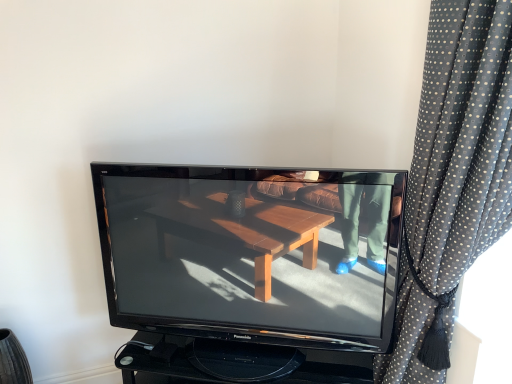
Question: From the image's perspective, is black glossy television at center located above or below black dotted fabric at right?

Choices:
 (A) above
 (B) below

Answer: (B)

Question: Considering the positions of black glossy television at center and black dotted fabric at right in the image, is black glossy television at center wider or thinner than black dotted fabric at right?

Choices:
 (A) wide
 (B) thin

Answer: (B)

Question: Based on their positions, is black glossy television at center located to the left or right of black dotted fabric at right?

Choices:
 (A) left
 (B) right

Answer: (A)

Question: From the image's perspective, is black dotted fabric at right located above or below black glossy television at center?

Choices:
 (A) above
 (B) below

Answer: (A)

Question: Looking at the image, does black dotted fabric at right seem bigger or smaller compared to black glossy television at center?

Choices:
 (A) small
 (B) big

Answer: (B)

Question: In the image, is black dotted fabric at right on the left side or the right side of black glossy television at center?

Choices:
 (A) left
 (B) right

Answer: (B)

Question: In terms of height, does black dotted fabric at right look taller or shorter compared to black glossy television at center?

Choices:
 (A) short
 (B) tall

Answer: (B)